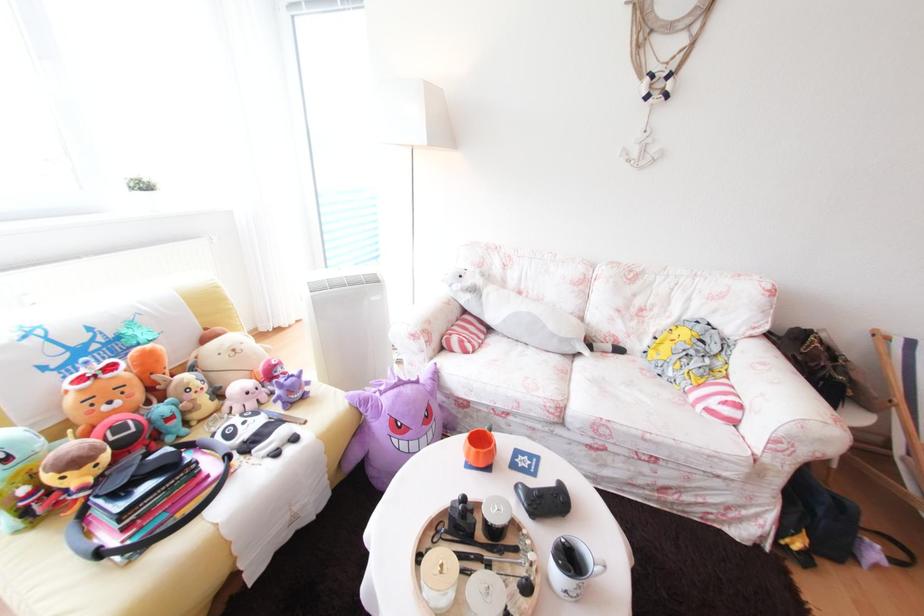
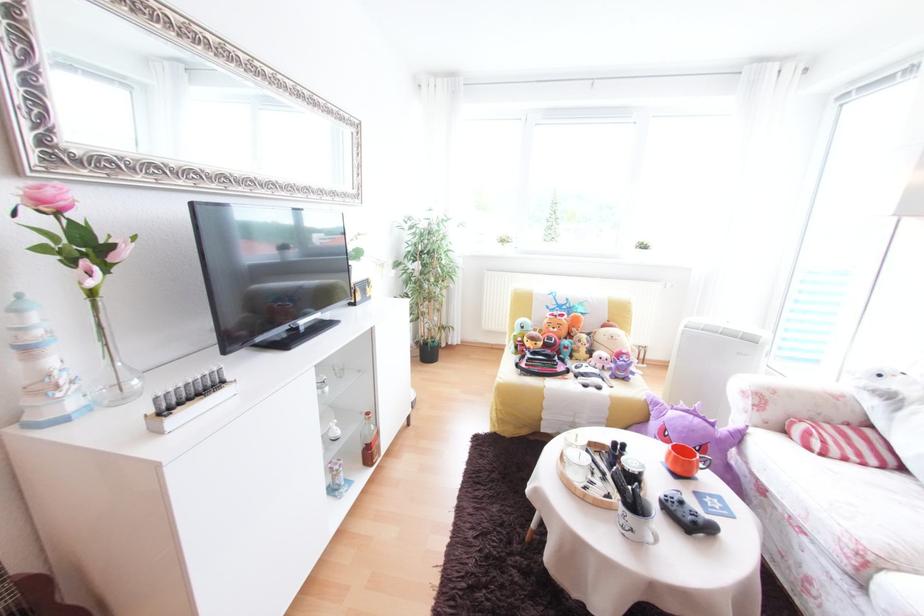
Locate, in the second image, the point that corresponds to (x=435, y=411) in the first image.

(709, 447)